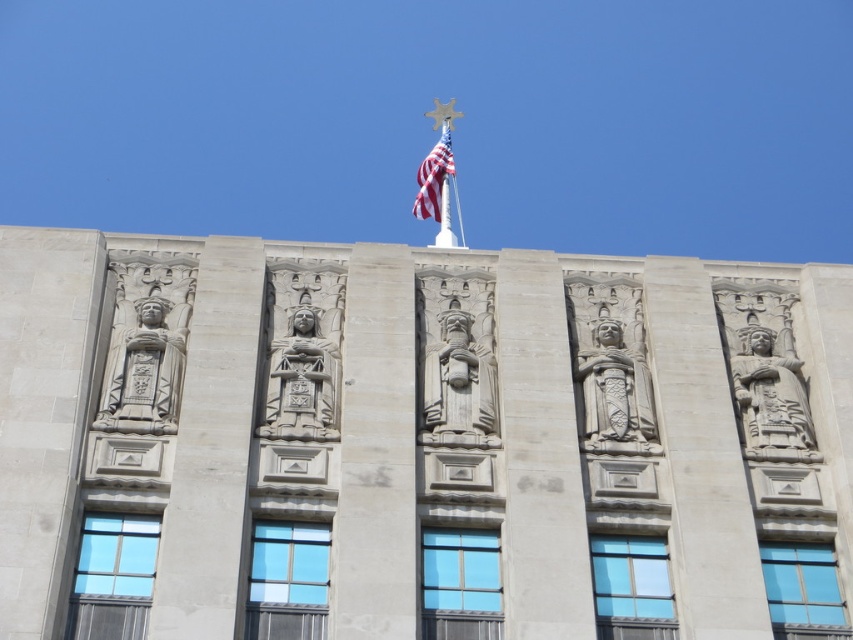
Question: Which of the following is the farthest from the observer?

Choices:
 (A) american flag at top
 (B) carved stone figure at center
 (C) gray stone statue at center left
 (D) carved stone pillar at center

Answer: (A)

Question: Where is gray stone statue at center left located in relation to polished stone statue at right in the image?

Choices:
 (A) below
 (B) above

Answer: (B)

Question: Which of these objects is positioned farthest from the polished stone statue at right?

Choices:
 (A) carved stone king at center
 (B) polished stone statue at center
 (C) gray stone statue at center left

Answer: (C)

Question: Is carved stone figure at center thinner than gray stone statue at center left?

Choices:
 (A) yes
 (B) no

Answer: (B)

Question: Does carved stone pillar at center appear under gray stone statue at center left?

Choices:
 (A) no
 (B) yes

Answer: (A)

Question: Which point is closer to the camera taking this photo?

Choices:
 (A) (312, 412)
 (B) (451, 378)

Answer: (A)